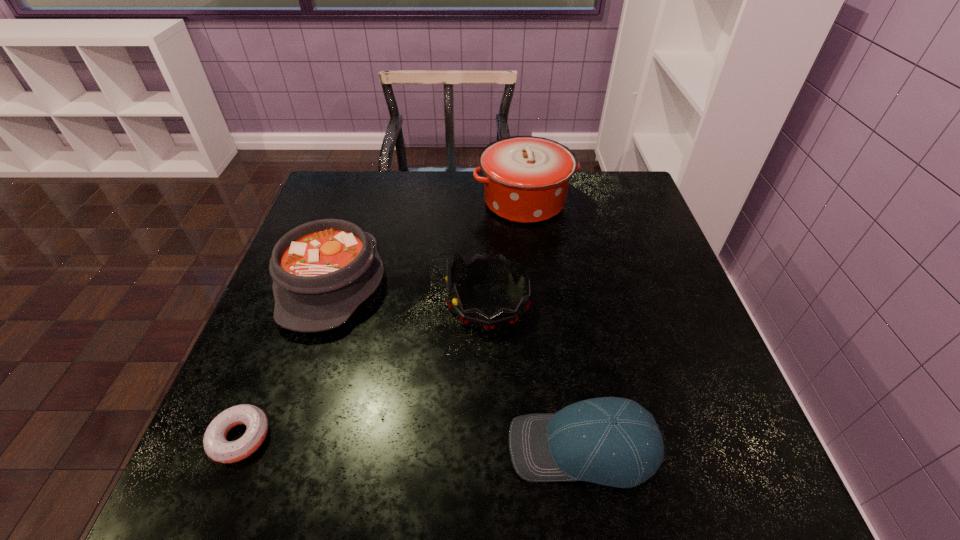
The height and width of the screenshot is (540, 960). In order to click on vacant point located between the shortest object and the tiara in this screenshot , I will do `click(364, 369)`.

In order to click on vacant area between the baseball cap and the tallest object in this screenshot , I will do `click(554, 324)`.

Where is `vacant point located between the shortest object and the tallest object`? vacant point located between the shortest object and the tallest object is located at coordinates (382, 319).

The height and width of the screenshot is (540, 960). Find the location of `free space between the tallest object and the nearer casserole`. free space between the tallest object and the nearer casserole is located at coordinates (428, 242).

Where is `empty location between the right casserole and the doughnut`? empty location between the right casserole and the doughnut is located at coordinates (382, 319).

Locate an element on the screen. The image size is (960, 540). object that is the closest to the farther casserole is located at coordinates (478, 265).

Locate which object is the fourth closest to the third shortest object. Please provide its 2D coordinates. Your answer should be formatted as a tuple, i.e. [(x, y)], where the tuple contains the x and y coordinates of a point satisfying the conditions above.

[(611, 441)]

What are the coordinates of `blank area in the image that satisfies the following two spatial constraints: 1. on the front side of the right casserole; 2. at the front of the tiara with jewels` in the screenshot? It's located at (537, 301).

Locate an element on the screen. The height and width of the screenshot is (540, 960). free space that satisfies the following two spatial constraints: 1. at the front of the fourth shortest object with jewels; 2. on the right side of the baseball cap is located at coordinates (491, 447).

You are a GUI agent. You are given a task and a screenshot of the screen. Output one action in this format:
    pyautogui.click(x=<x>, y=<y>)
    Task: Click on the free space that satisfies the following two spatial constraints: 1. at the front of the tiara with jewels; 2. on the back side of the baseball cap
    
    Given the screenshot: What is the action you would take?
    pyautogui.click(x=491, y=447)